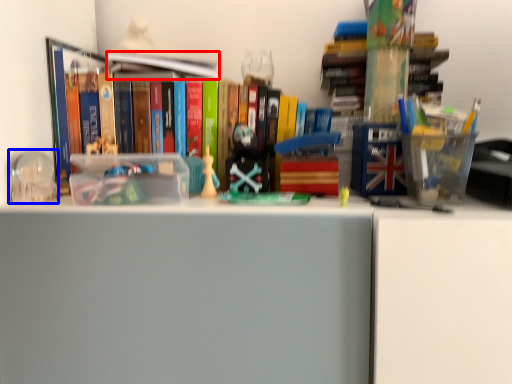
Question: Among these objects, which one is farthest to the camera, book (highlighted by a red box) or toy (highlighted by a blue box)?

Choices:
 (A) book
 (B) toy

Answer: (A)